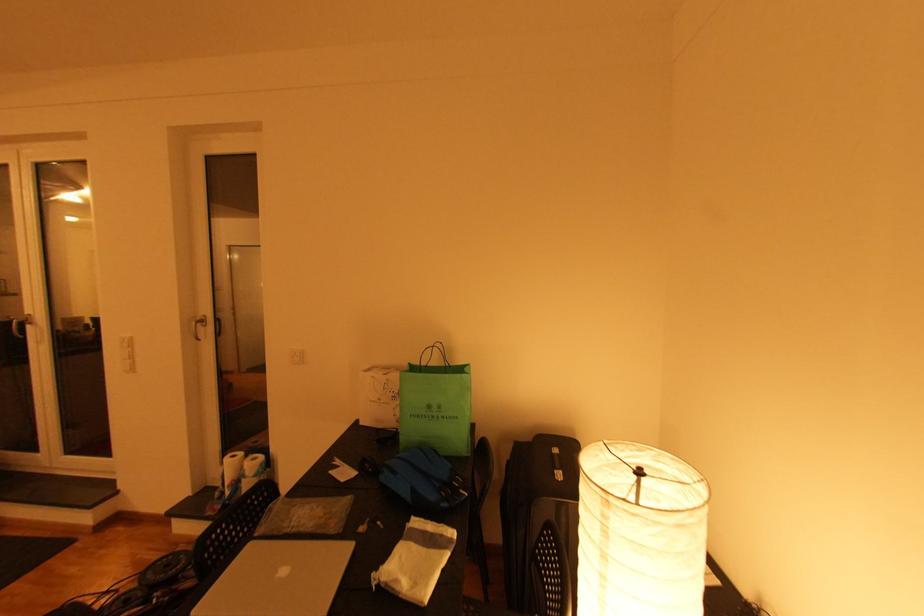
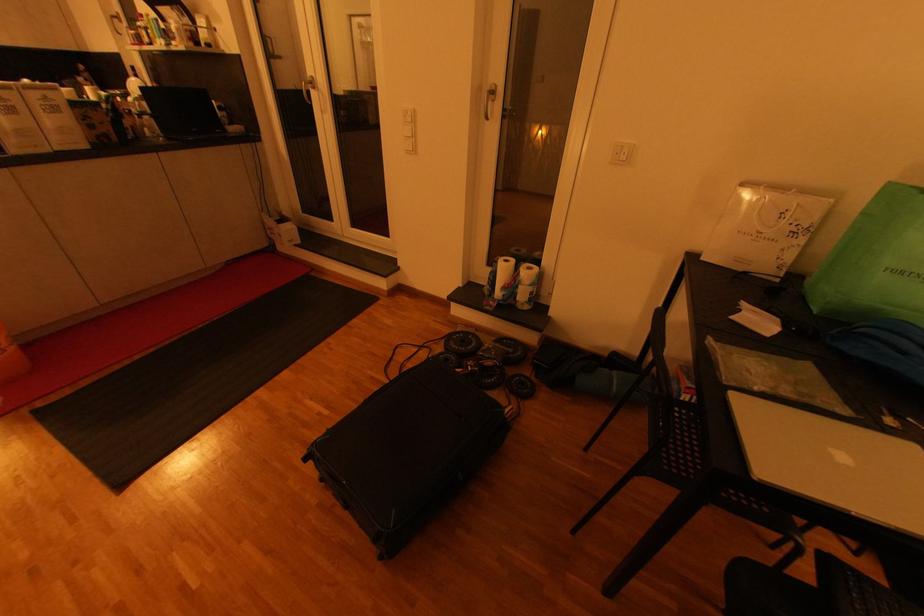
Find the pixel in the second image that matches (x=171, y=565) in the first image.

(468, 342)